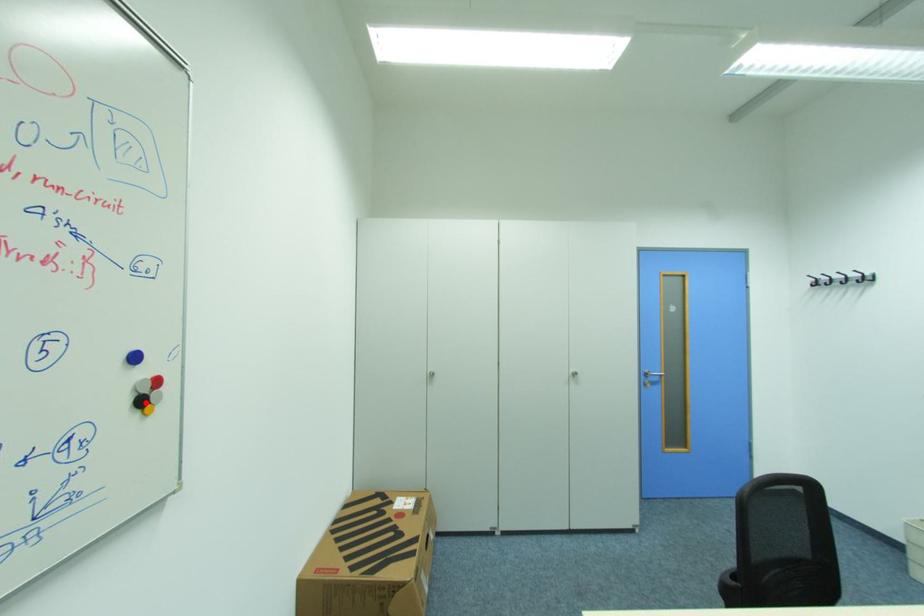
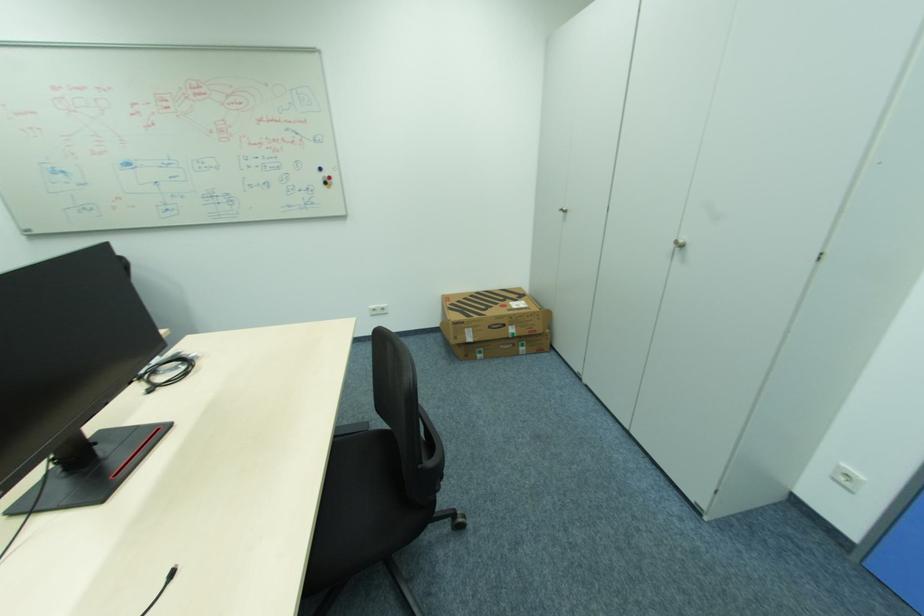
Question: I am providing you with two images of the same scene from different viewpoints. Image1 has a red point marked. In image2, the corresponding 3D location appears at what relative position? Reply with the corresponding letter.

Choices:
 (A) Closer
 (B) Farther

Answer: (A)